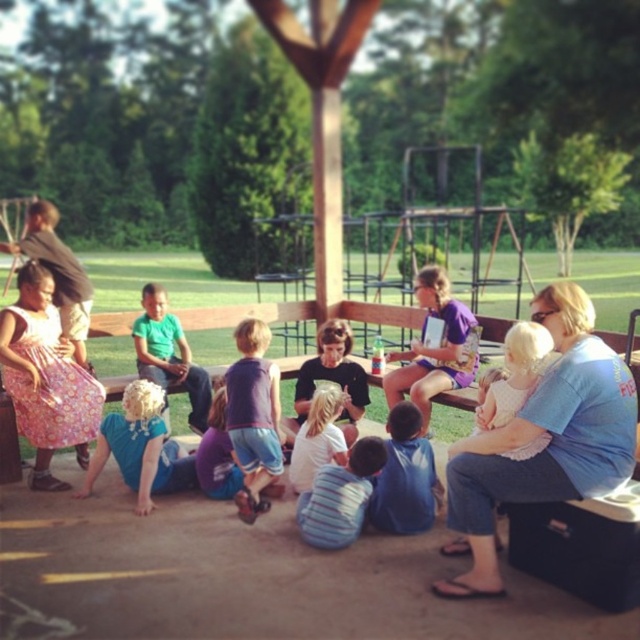
Question: Based on their relative distances, which object is nearer to the matte brown shirt at left?

Choices:
 (A) blue cotton shirt at center
 (B) white lace dress at center

Answer: (B)

Question: Which point is farther to the camera?

Choices:
 (A) blue fabric shirt at lower left
 (B) blue denim shirt at lower center

Answer: (A)

Question: Can you confirm if blue cotton shirt at center is smaller than blue fabric shirt at lower left?

Choices:
 (A) no
 (B) yes

Answer: (A)

Question: Which of the following is the closest to the observer?

Choices:
 (A) light blonde hair at center
 (B) blue denim shirt at lower center

Answer: (B)

Question: Can you confirm if blue denim shirt at lower center is bigger than green matte shirt at center?

Choices:
 (A) yes
 (B) no

Answer: (B)

Question: Is blue fabric shirt at lower left thinner than light blonde hair at center?

Choices:
 (A) no
 (B) yes

Answer: (A)